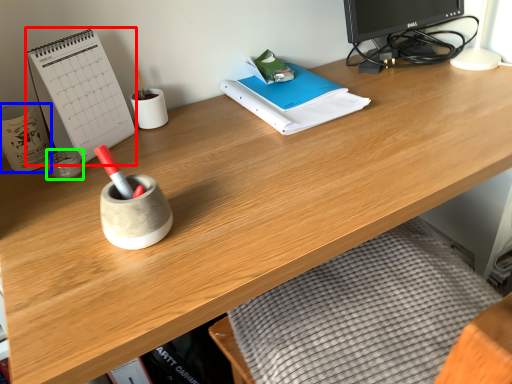
Question: Which is farther away from paperback book (highlighted by a red box)? stationery (highlighted by a blue box) or stationery (highlighted by a green box)?

Choices:
 (A) stationery
 (B) stationery

Answer: (B)